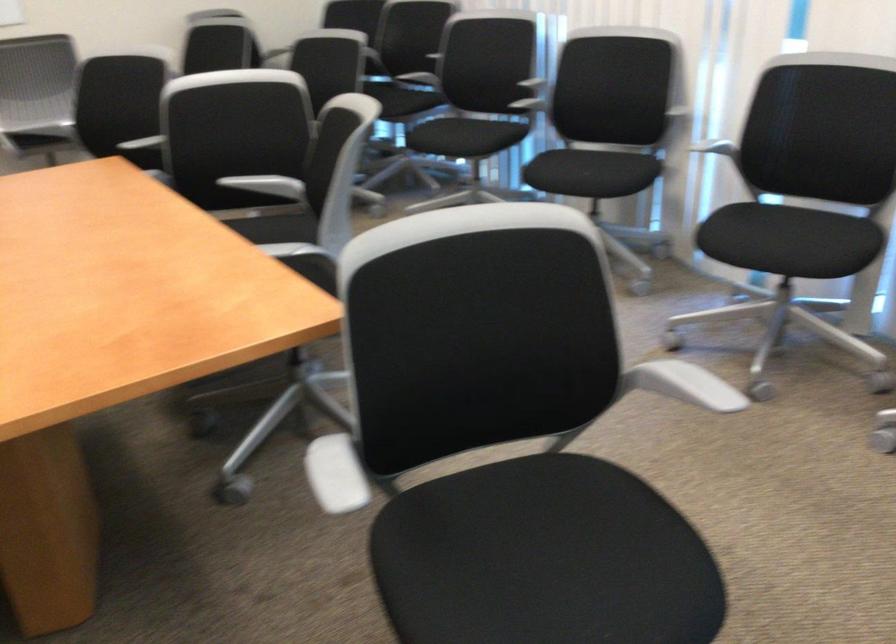
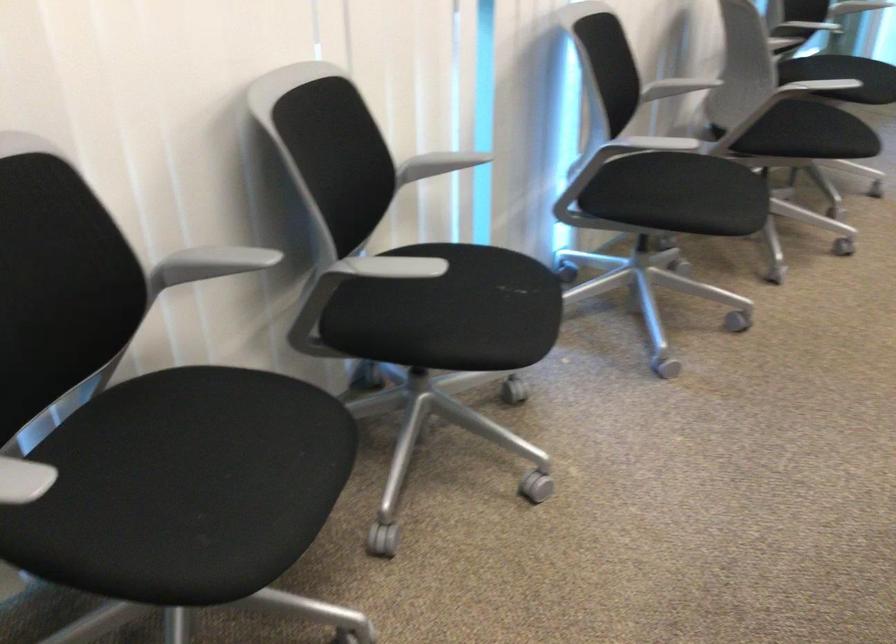
In the second image, find the point that corresponds to [526,82] in the first image.

(211, 263)